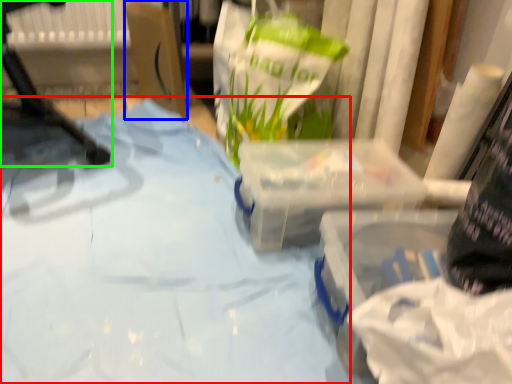
Question: Which object is the farthest from sheet (highlighted by a red box)? Choose among these: cardboard box (highlighted by a blue box) or furniture (highlighted by a green box).

Choices:
 (A) cardboard box
 (B) furniture

Answer: (A)